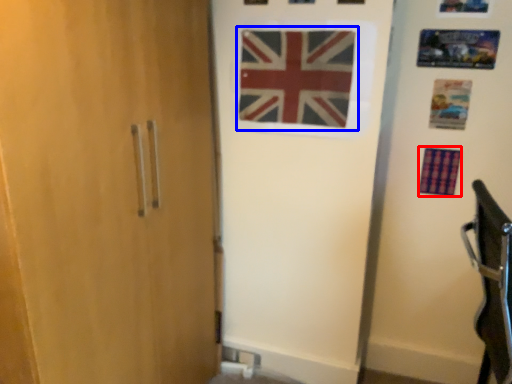
Question: Which point is further to the camera, flag (highlighted by a red box) or flag (highlighted by a blue box)?

Choices:
 (A) flag
 (B) flag

Answer: (A)